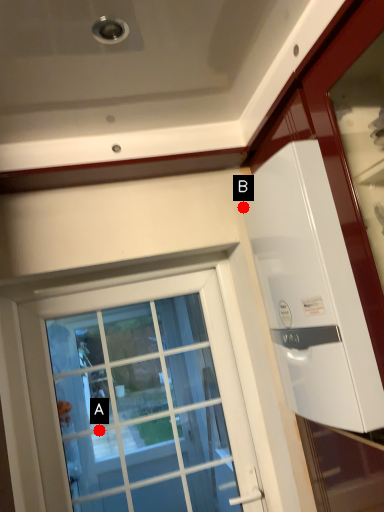
Question: Two points are circled on the image, labeled by A and B beside each circle. Which of the following is the farthest from the observer?

Choices:
 (A) A is further
 (B) B is further

Answer: (A)